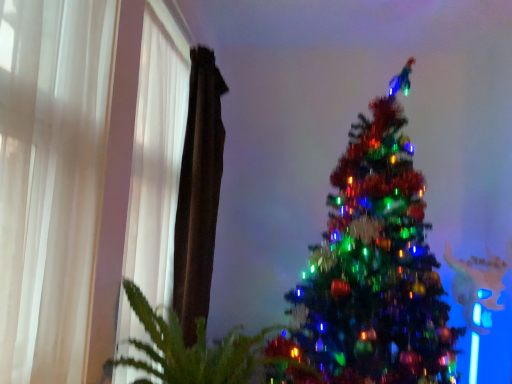
Question: Can we say white sheer curtain at left, marked as the 2th curtain in a front-to-back arrangement, lies outside shiny green christmas tree at center?

Choices:
 (A) no
 (B) yes

Answer: (B)

Question: Is white sheer curtain at left, arranged as the second curtain when viewed from the back, taller than shiny green christmas tree at center?

Choices:
 (A) yes
 (B) no

Answer: (B)

Question: Is white sheer curtain at left, marked as the 2th curtain in a front-to-back arrangement, to the right of shiny green christmas tree at center from the viewer's perspective?

Choices:
 (A) yes
 (B) no

Answer: (B)

Question: Does white sheer curtain at left, arranged as the second curtain when viewed from the back, have a larger size compared to shiny green christmas tree at center?

Choices:
 (A) no
 (B) yes

Answer: (A)

Question: Considering the relative positions of white sheer curtain at left, arranged as the second curtain when viewed from the back, and shiny green christmas tree at center in the image provided, is white sheer curtain at left, arranged as the second curtain when viewed from the back, to the left of shiny green christmas tree at center from the viewer's perspective?

Choices:
 (A) no
 (B) yes

Answer: (B)

Question: From a real-world perspective, is brown fabric curtain at left, the first curtain viewed from the back, physically located above or below green leafy plant at lower left?

Choices:
 (A) above
 (B) below

Answer: (A)

Question: Considering the positions of brown fabric curtain at left, the third curtain in the front-to-back sequence, and green leafy plant at lower left in the image, is brown fabric curtain at left, the third curtain in the front-to-back sequence, bigger or smaller than green leafy plant at lower left?

Choices:
 (A) big
 (B) small

Answer: (B)

Question: Do you think brown fabric curtain at left, the third curtain in the front-to-back sequence, is within green leafy plant at lower left, or outside of it?

Choices:
 (A) inside
 (B) outside

Answer: (B)

Question: Is brown fabric curtain at left, the first curtain viewed from the back, in front of or behind green leafy plant at lower left in the image?

Choices:
 (A) front
 (B) behind

Answer: (B)

Question: From a real-world perspective, is white sheer curtain at left, which is counted as the 3th curtain, starting from the back, positioned above or below brown fabric curtain at left, the first curtain viewed from the back?

Choices:
 (A) below
 (B) above

Answer: (A)

Question: Relative to brown fabric curtain at left, the first curtain viewed from the back, is white sheer curtain at left, which is counted as the 3th curtain, starting from the back, in front or behind?

Choices:
 (A) front
 (B) behind

Answer: (A)

Question: Considering the positions of point (54, 236) and point (216, 172), is point (54, 236) closer or farther from the camera than point (216, 172)?

Choices:
 (A) closer
 (B) farther

Answer: (A)

Question: Looking at their shapes, would you say white sheer curtain at left, which is counted as the 3th curtain, starting from the back, is wider or thinner than brown fabric curtain at left, the third curtain in the front-to-back sequence?

Choices:
 (A) thin
 (B) wide

Answer: (A)

Question: Considering the relative positions of white sheer curtain at left, which is counted as the 3th curtain, starting from the back, and white sheer curtain at left, marked as the 2th curtain in a front-to-back arrangement, in the image provided, is white sheer curtain at left, which is counted as the 3th curtain, starting from the back, to the left or to the right of white sheer curtain at left, marked as the 2th curtain in a front-to-back arrangement,?

Choices:
 (A) right
 (B) left

Answer: (B)

Question: From a real-world perspective, relative to white sheer curtain at left, arranged as the second curtain when viewed from the back, is white sheer curtain at left, which is counted as the 3th curtain, starting from the back, vertically above or below?

Choices:
 (A) below
 (B) above

Answer: (A)